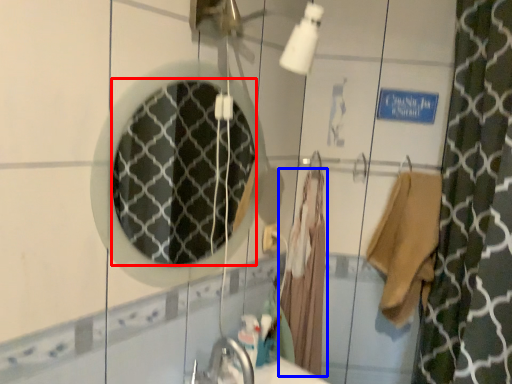
Question: Among these objects, which one is farthest to the camera, mirror (highlighted by a red box) or bathrobe (highlighted by a blue box)?

Choices:
 (A) mirror
 (B) bathrobe

Answer: (B)